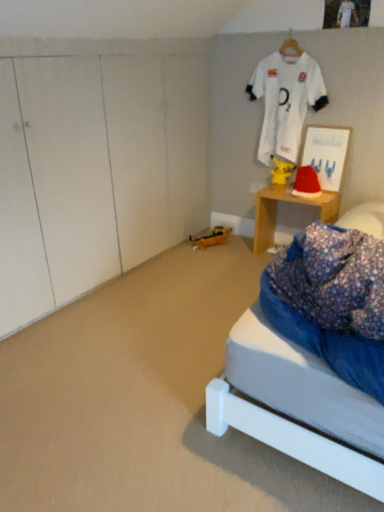
You are a GUI agent. You are given a task and a screenshot of the screen. Output one action in this format:
    pyautogui.click(x=<x>, y=<y>)
    Task: Click on the free spot in front of red velvet santa hat at right
    The height and width of the screenshot is (512, 384).
    Given the screenshot: What is the action you would take?
    pyautogui.click(x=316, y=197)